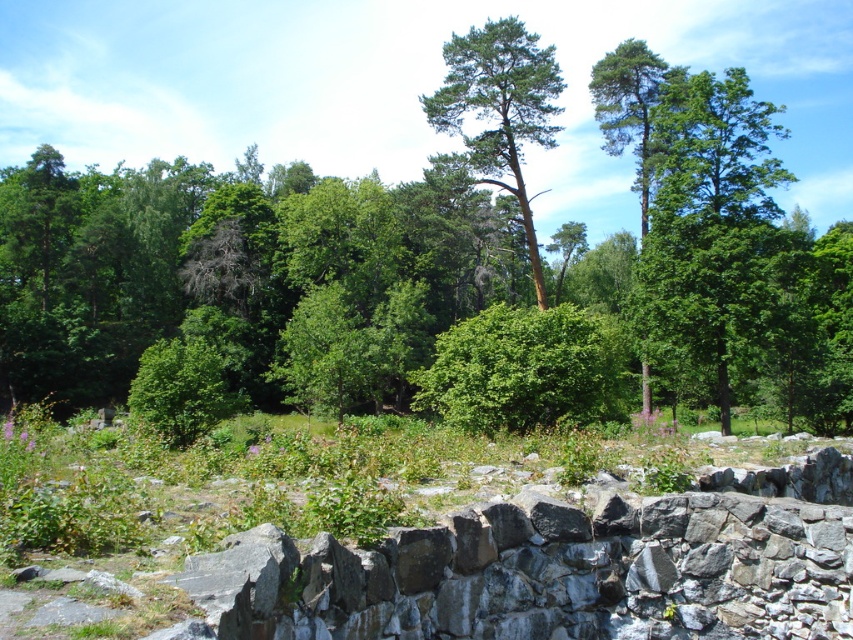
You are standing at the stone wall in the foreground of the image. Looking towards the center, you see a point marked at coordinates (442, 250). What does this point represent in the scene?

The point at coordinates (442, 250) represents the green leafy forest at center.

Consider the image. You are a hiker who wants to take a photo of the green leafy forest at center and the green rough bark tree at center. Which one appears wider in the photo?

The green leafy forest at center appears wider than the green rough bark tree at center in the photo because its width surpasses the tree.